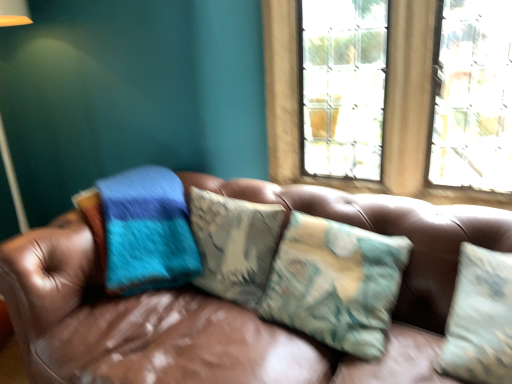
Question: Would you say brown leather couch at center is inside or outside camouflage fabric pillow at center?

Choices:
 (A) inside
 (B) outside

Answer: (B)

Question: Is brown leather couch at center in front of or behind camouflage fabric pillow at center in the image?

Choices:
 (A) front
 (B) behind

Answer: (A)

Question: Which object is the farthest from the brown leather couch at center?

Choices:
 (A) camouflage fabric pillow at center
 (B) clear glass window at upper center

Answer: (B)

Question: Which object is positioned closest to the brown leather couch at center?

Choices:
 (A) clear glass window at upper center
 (B) camouflage fabric pillow at center

Answer: (B)